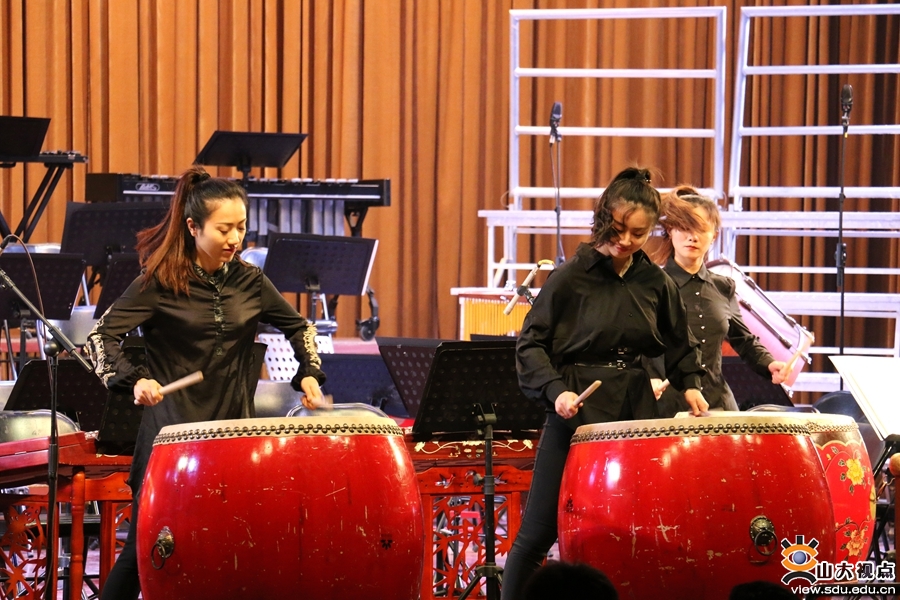
Locate an element on the screen. The width and height of the screenshot is (900, 600). music stands is located at coordinates (259, 144), (22, 135), (54, 270), (112, 282), (321, 279), (487, 403), (424, 369), (370, 373).